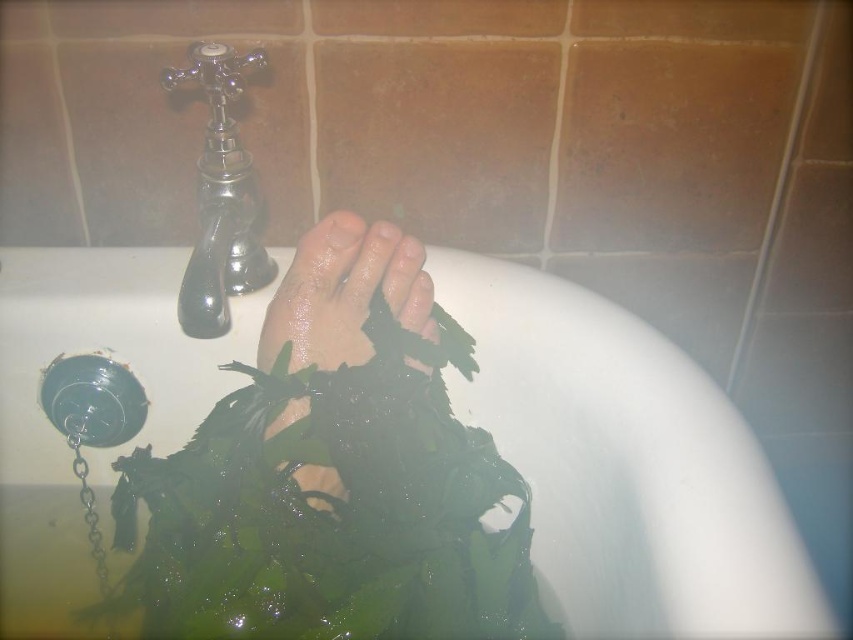
Question: Can you confirm if slick skin foot at center is positioned below chrome/metallic faucet at upper left?

Choices:
 (A) no
 (B) yes

Answer: (B)

Question: Which point appears farthest from the camera in this image?

Choices:
 (A) (601, 381)
 (B) (222, 72)
 (C) (345, 276)

Answer: (B)

Question: Which object is positioned closest to the chrome/metallic faucet at upper left?

Choices:
 (A) slick skin foot at center
 (B) green leafy plant at center

Answer: (A)

Question: Can you confirm if green leafy plant at center is thinner than chrome/metallic faucet at upper left?

Choices:
 (A) no
 (B) yes

Answer: (A)

Question: Can you confirm if slick skin foot at center is positioned to the right of chrome/metallic faucet at upper left?

Choices:
 (A) no
 (B) yes

Answer: (B)

Question: Which object appears closest to the camera in this image?

Choices:
 (A) chrome/metallic faucet at upper left
 (B) green leafy plant at center
 (C) slick skin foot at center

Answer: (B)